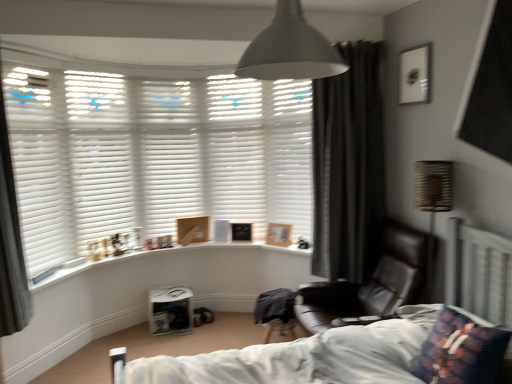
Question: From a real-world perspective, relative to white matte blinds at upper left, which ranks as the 4th shutter in right-to-left order, is matte gray lampshade at upper center vertically above or below?

Choices:
 (A) above
 (B) below

Answer: (A)

Question: Considering the positions of matte gray lampshade at upper center and white matte blinds at upper left, which ranks as the 4th shutter in right-to-left order, in the image, is matte gray lampshade at upper center bigger or smaller than white matte blinds at upper left, which ranks as the 4th shutter in right-to-left order,?

Choices:
 (A) small
 (B) big

Answer: (A)

Question: Estimate the real-world distances between objects in this image. Which object is farther from the white matte blinds at left, the 1th shutter viewed from the left?

Choices:
 (A) wooden picture frame at window sill, the second picture frame when ordered from bottom to top
 (B) matte gray lampshade at upper center
 (C) white matte shutter at upper center, marked as the third shutter in a left-to-right arrangement
 (D) dark grey curtain at right, which is the 1th curtain from back to front
 (E) gray fabric curtain at left, the first curtain when ordered from front to back

Answer: (B)

Question: Estimate the real-world distances between objects in this image. Which object is farther from the wooden picture frame at window sill, the second picture frame when ordered from bottom to top?

Choices:
 (A) white matte shutter at upper center, marked as the fifth shutter in a left-to-right arrangement
 (B) woven fabric table lamp at right
 (C) dark floral fabric pillow at lower right
 (D) matte gray lampshade at upper center
 (E) matte black picture frame at upper right, arranged as the 1th picture frame when viewed from the top

Answer: (D)